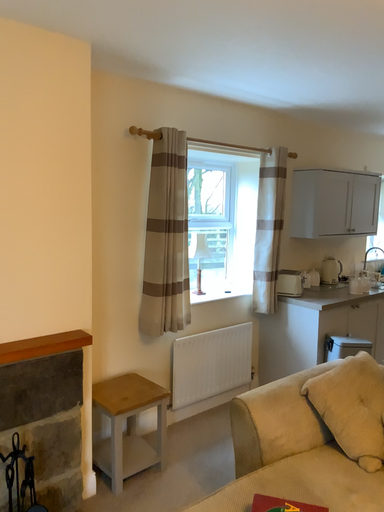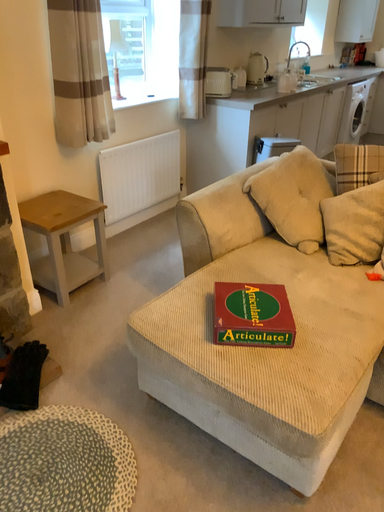
Question: Which way did the camera rotate in the video?

Choices:
 (A) rotated upward
 (B) rotated downward

Answer: (B)